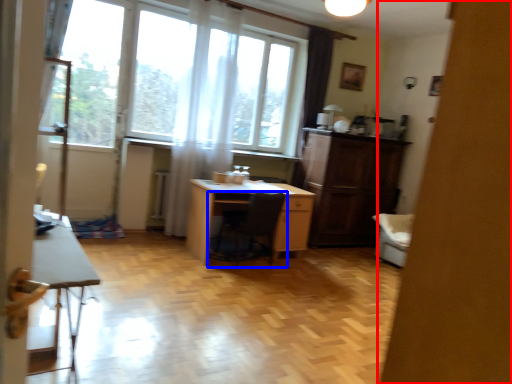
Question: Among these objects, which one is farthest to the camera, screen door (highlighted by a red box) or chair (highlighted by a blue box)?

Choices:
 (A) screen door
 (B) chair

Answer: (B)